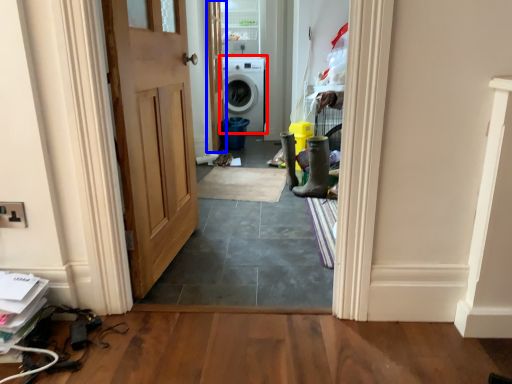
Question: Among these objects, which one is farthest to the camera, washing machine (highlighted by a red box) or door (highlighted by a blue box)?

Choices:
 (A) washing machine
 (B) door

Answer: (A)